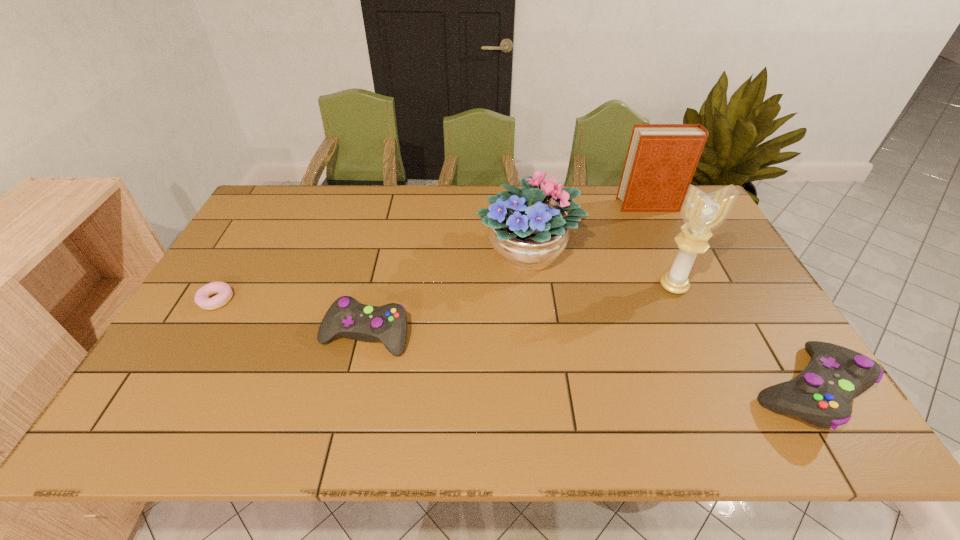
To make them evenly spaced by inserting another control among them, please locate a free space for this new control. Please provide its 2D coordinates. Your answer should be formatted as a tuple, i.e. [(x, y)], where the tuple contains the x and y coordinates of a point satisfying the conditions above.

[(574, 360)]